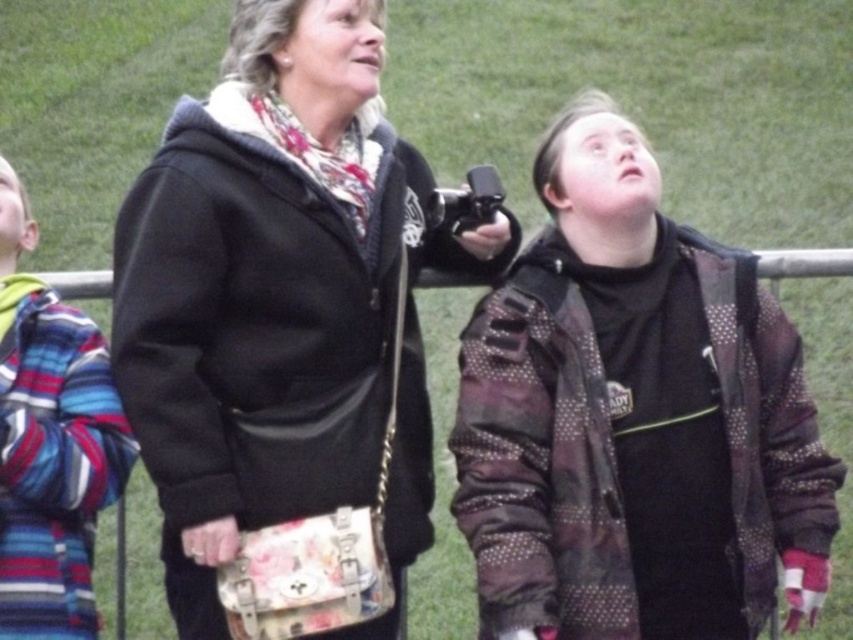
Does point (498, 424) come in front of point (428, 220)?

Yes, point (498, 424) is closer to viewer.

The image size is (853, 640). What do you see at coordinates (634, 419) in the screenshot? I see `camouflage jacket at center` at bounding box center [634, 419].

What are the coordinates of `camouflage jacket at center` in the screenshot? It's located at (634, 419).

Can you confirm if camouflage jacket at center is positioned to the left of striped wool sweater at left?

In fact, camouflage jacket at center is to the right of striped wool sweater at left.

Is camouflage jacket at center below striped wool sweater at left?

No, camouflage jacket at center is not below striped wool sweater at left.

Is point (811, 528) more distant than point (103, 388)?

Yes, point (811, 528) is behind point (103, 388).

Where is `camouflage jacket at center`? camouflage jacket at center is located at coordinates (634, 419).

Can you confirm if black fabric jacket at center is bigger than striped wool sweater at left?

Indeed, black fabric jacket at center has a larger size compared to striped wool sweater at left.

The image size is (853, 640). I want to click on black fabric jacket at center, so click(271, 288).